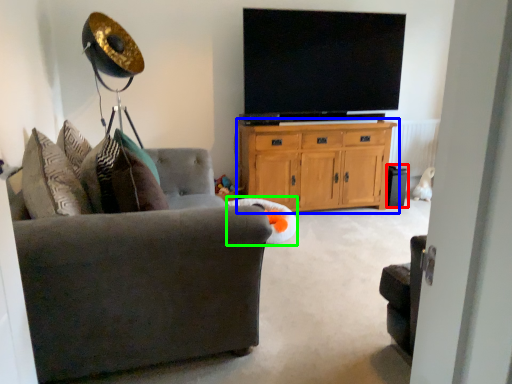
Question: Considering the real-world distances, which object is farthest from speaker (highlighted by a red box)? cabinetry (highlighted by a blue box) or bean bag chair (highlighted by a green box)?

Choices:
 (A) cabinetry
 (B) bean bag chair

Answer: (B)